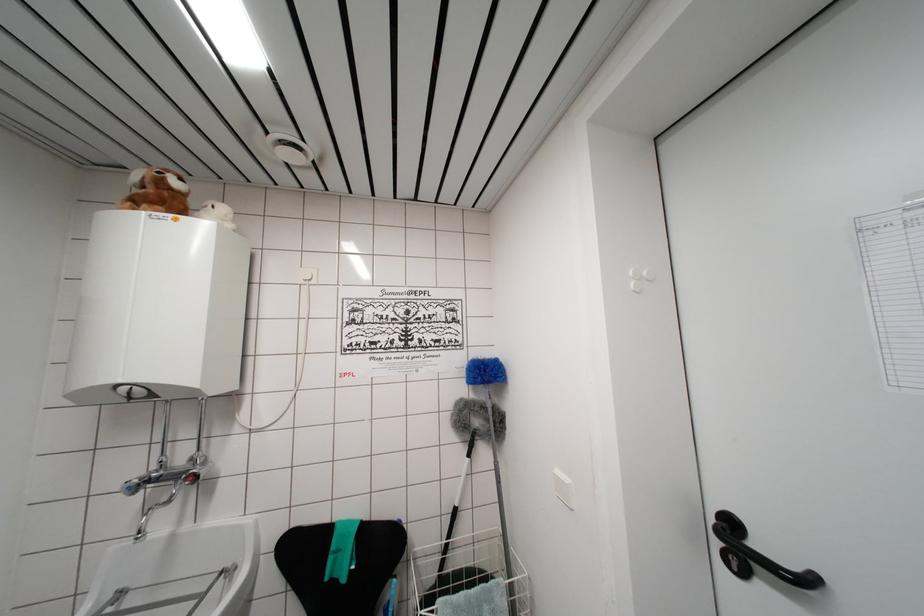
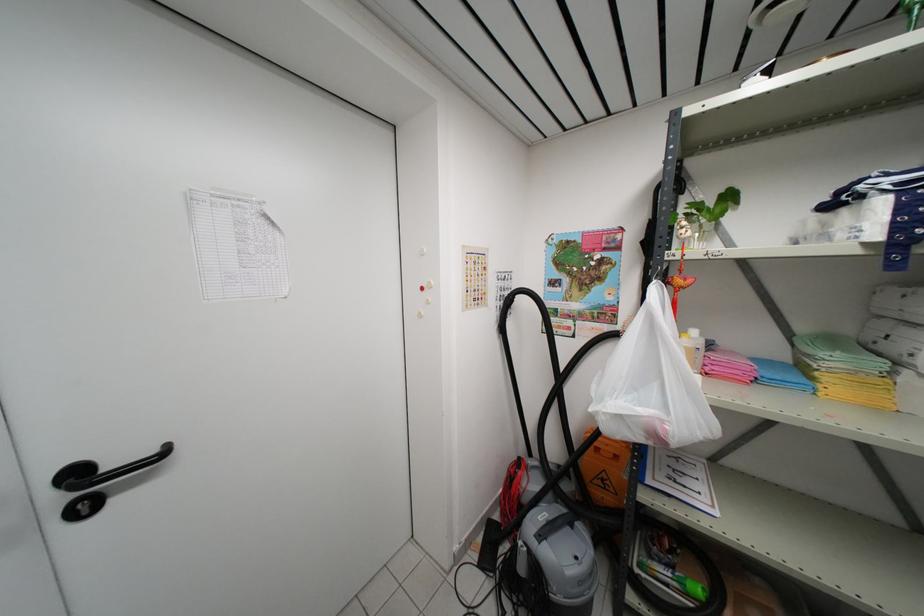
The point at (735, 562) is marked in the first image. Where is the corresponding point in the second image?

(83, 512)